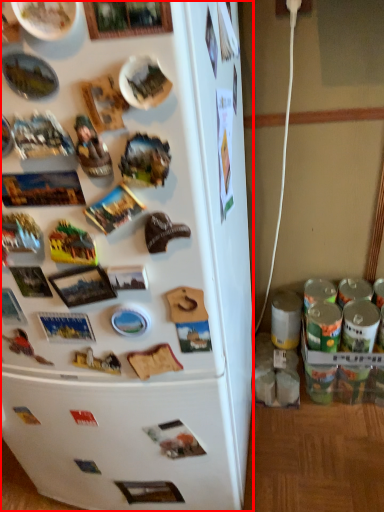
Question: Where is refrigerator (annotated by the red box) located in relation to toy in the image?

Choices:
 (A) right
 (B) left

Answer: (B)